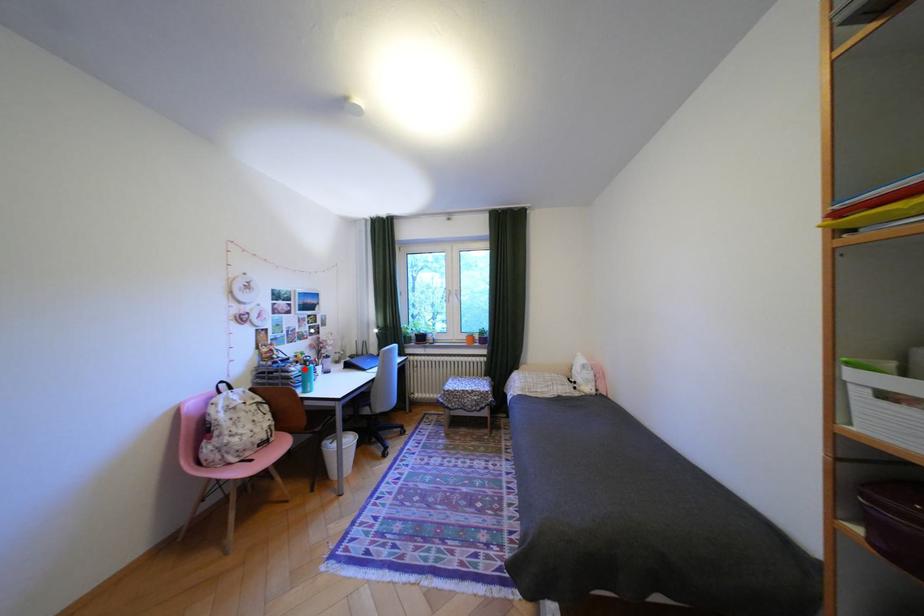
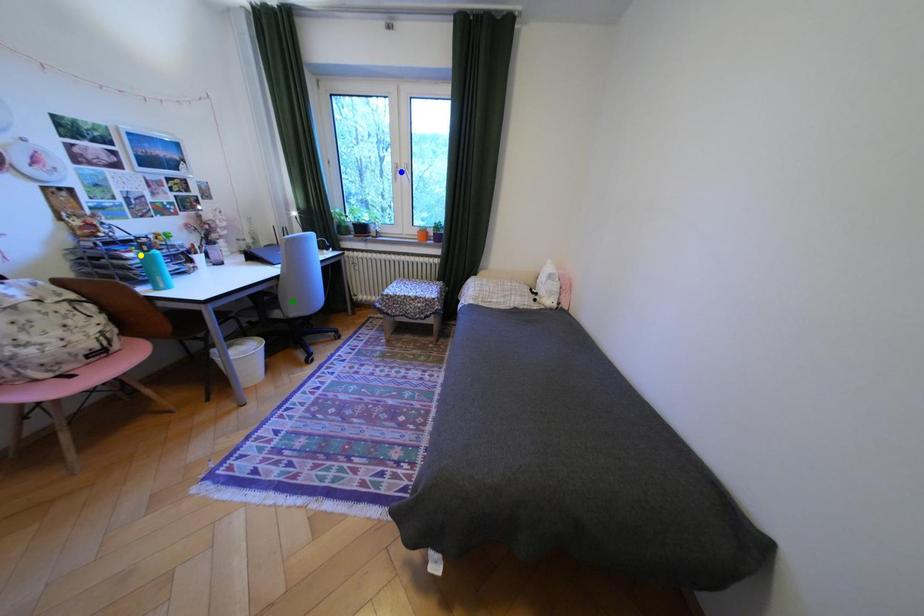
Question: I am providing you with two images of the same scene from different viewpoints. A red point is marked on the first image. You are given multiple points on the second image. Which mark in image 2 goes with the point in image 1?

Choices:
 (A) yellow point
 (B) green point
 (C) blue point

Answer: (A)